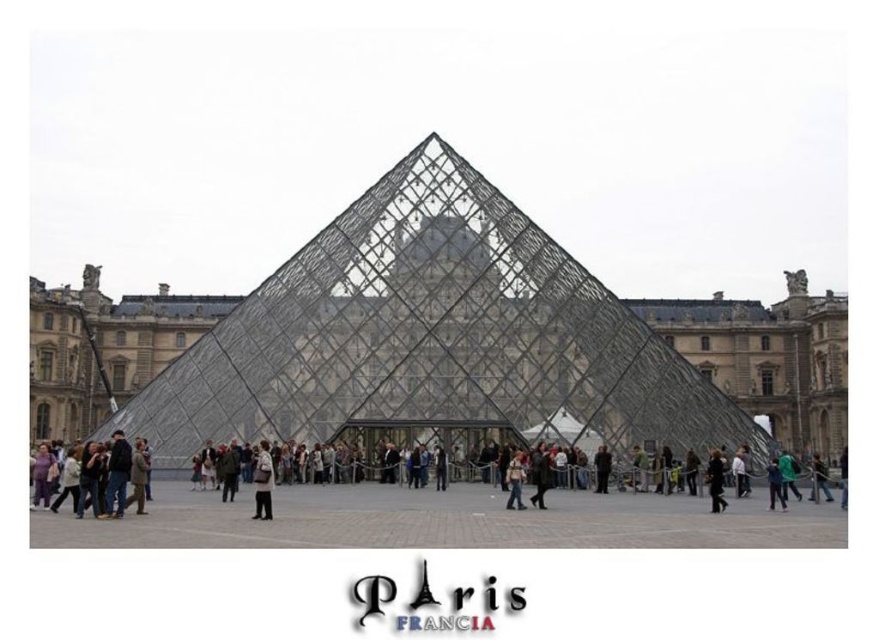
Which is behind, point (519, 458) or point (779, 472)?

Positioned behind is point (519, 458).

Is denim jacket at center thinner than dark blue jeans at center?

Yes, denim jacket at center is thinner than dark blue jeans at center.

Does point (516, 508) come farther from viewer compared to point (783, 504)?

That is False.

Image resolution: width=879 pixels, height=640 pixels. In order to click on denim jacket at center in this screenshot , I will do `click(514, 481)`.

Who is more forward, (x=266, y=460) or (x=819, y=458)?

Point (x=266, y=460) is more forward.

Who is more forward, (259, 509) or (822, 490)?

Point (259, 509) is in front.

In order to click on white fabric bag at center in this screenshot , I will do `click(262, 481)`.

Which is more to the left, denim jacket at center or dark gray fabric jacket at lower right?

From the viewer's perspective, denim jacket at center appears more on the left side.

Between point (507, 477) and point (819, 460), which one is positioned in front?

Point (507, 477) is in front.

Identify the location of denim jacket at center. The image size is (879, 640). (514, 481).